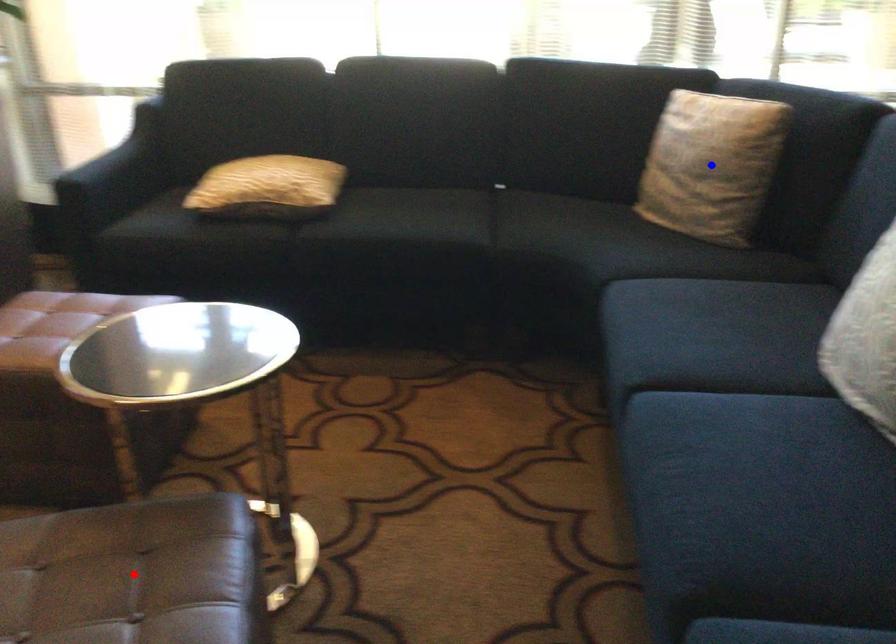
Question: In the image, two points are highlighted. Which point is nearer to the camera? Reply with the corresponding letter.

Choices:
 (A) blue point
 (B) red point

Answer: (B)